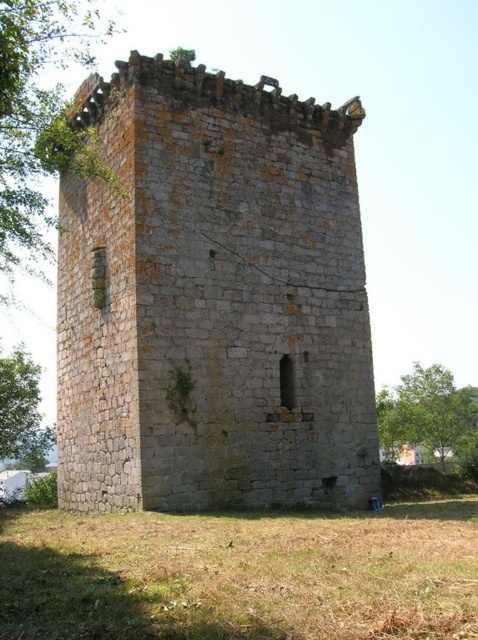
Question: Can you confirm if green leafy tree at upper left is wider than green leafy tree at lower left?

Choices:
 (A) no
 (B) yes

Answer: (B)

Question: Observing the image, what is the correct spatial positioning of green leafy tree at lower right in reference to green leafy tree at lower left?

Choices:
 (A) above
 (B) below

Answer: (B)

Question: Which object is positioned farthest from the green leafy tree at lower right?

Choices:
 (A) green leafy tree at lower left
 (B) green leafy tree at upper left
 (C) gray stone tower at center

Answer: (B)

Question: Is gray stone tower at center smaller than green leafy tree at lower left?

Choices:
 (A) no
 (B) yes

Answer: (A)

Question: Which point is farther to the camera?

Choices:
 (A) gray stone tower at center
 (B) green leafy tree at upper left
 (C) green leafy tree at lower right

Answer: (C)

Question: Which of the following is the farthest from the observer?

Choices:
 (A) (63, 132)
 (B) (412, 419)
 (C) (26, 372)

Answer: (B)